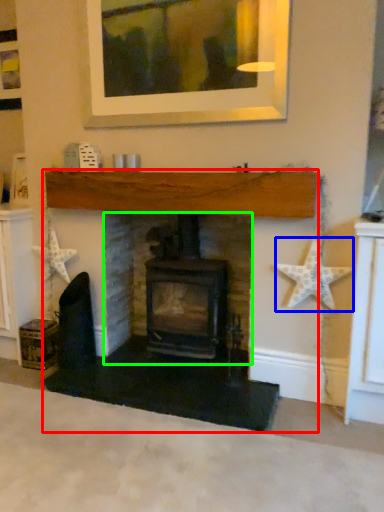
Question: Which object is the closest to the fireplace (highlighted by a red box)? Choose among these: starfish (highlighted by a blue box) or fireplace (highlighted by a green box).

Choices:
 (A) starfish
 (B) fireplace

Answer: (B)